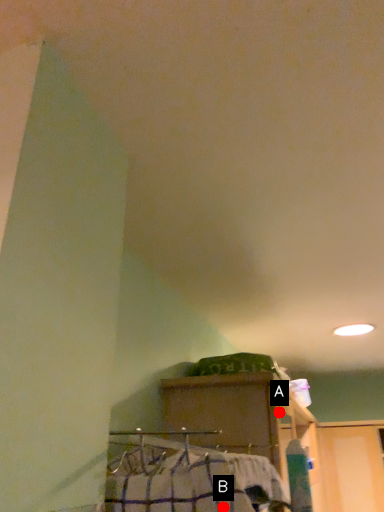
Question: Two points are circled on the image, labeled by A and B beside each circle. Among these points, which one is nearest to the camera?

Choices:
 (A) A is closer
 (B) B is closer

Answer: (B)